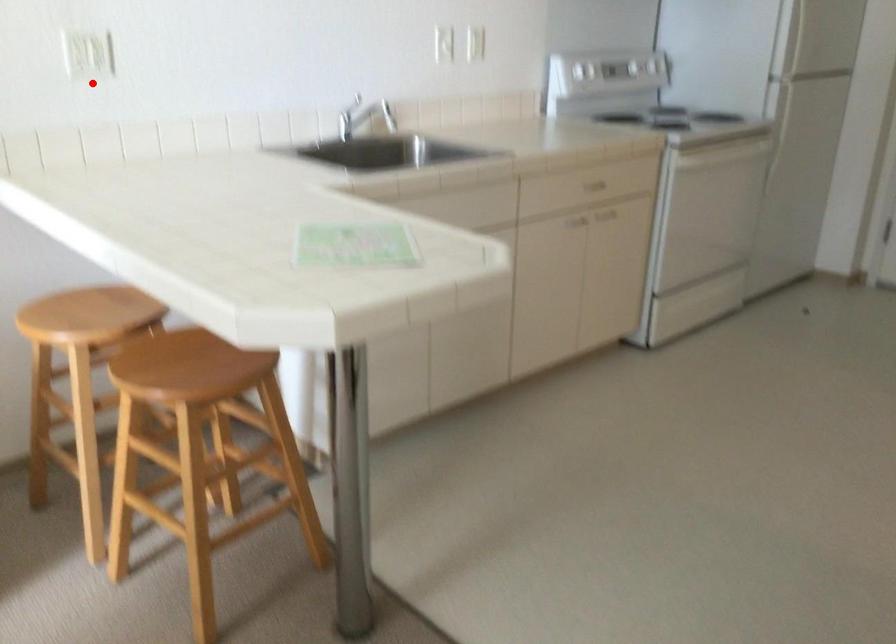
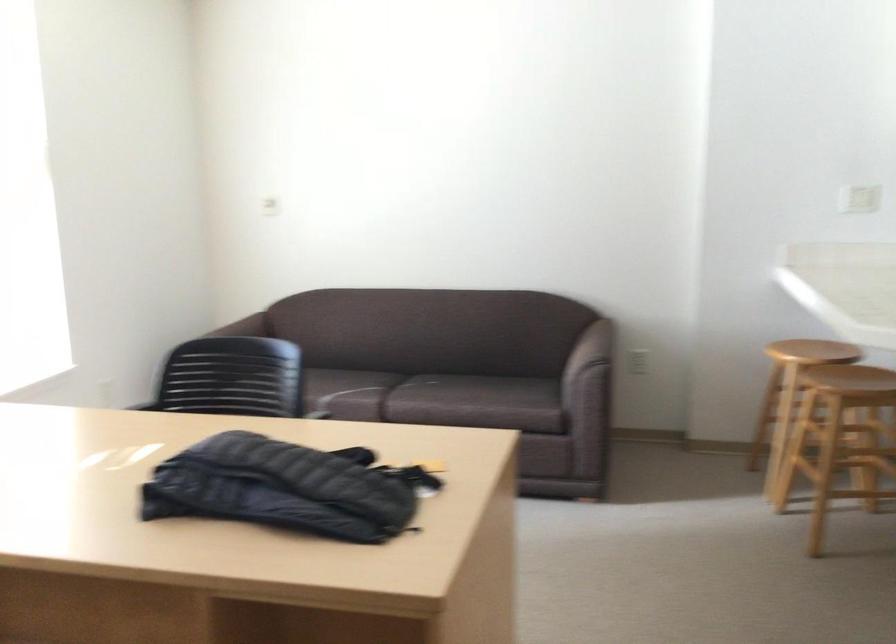
Question: A red point is marked in image1. In image2, is the corresponding 3D point closer to the camera or farther? Reply with the corresponding letter.

Choices:
 (A) The corresponding 3D point is closer.
 (B) The corresponding 3D point is farther.

Answer: (B)